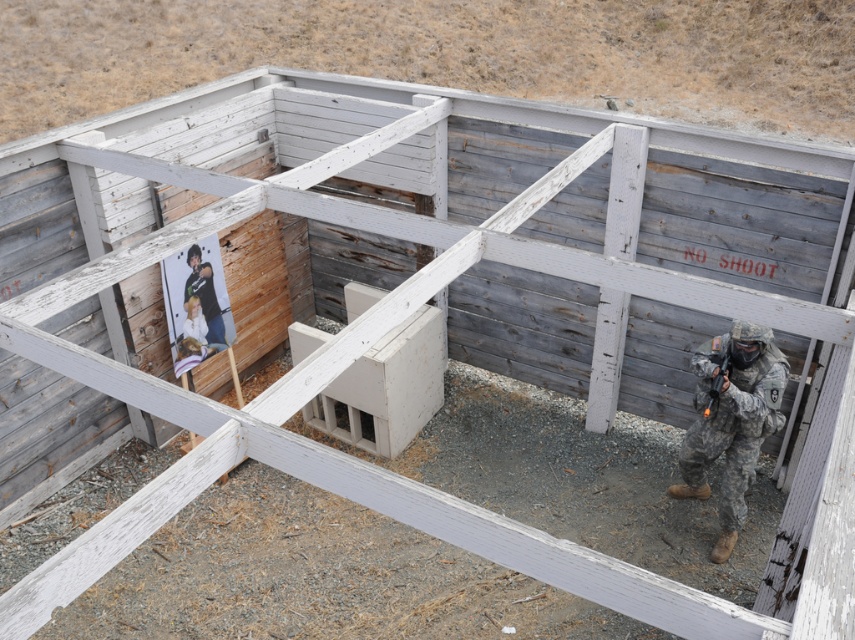
Can you confirm if camouflage uniform at center is wider than matte black rifle at right?

Indeed, camouflage uniform at center has a greater width compared to matte black rifle at right.

Is point (215, 304) less distant than point (716, 384)?

No, (215, 304) is behind (716, 384).

Is point (199, 266) farther from camera compared to point (708, 397)?

Yes, it is behind point (708, 397).

Identify the location of camouflage uniform at center. The height and width of the screenshot is (640, 855). [202, 300].

Between camouflage fabric soldier at right and matte black rifle at right, which one has more height?

Standing taller between the two is camouflage fabric soldier at right.

Is camouflage fabric soldier at right to the right of matte black rifle at right from the viewer's perspective?

Indeed, camouflage fabric soldier at right is positioned on the right side of matte black rifle at right.

Between point (724, 440) and point (718, 387), which one is positioned behind?

The point (724, 440) is behind.

In order to click on camouflage fabric soldier at right in this screenshot , I will do `click(730, 419)`.

Is camouflage fabric soldier at right below camouflage uniform at center?

Correct, camouflage fabric soldier at right is located below camouflage uniform at center.

Does camouflage fabric soldier at right have a smaller size compared to camouflage uniform at center?

Incorrect, camouflage fabric soldier at right is not smaller in size than camouflage uniform at center.

Does point (709, 460) come closer to viewer compared to point (190, 321)?

Yes, it is.

Where is `camouflage fabric soldier at right`? camouflage fabric soldier at right is located at coordinates (730, 419).